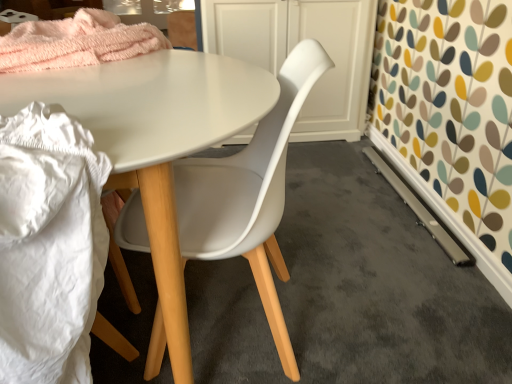
The width and height of the screenshot is (512, 384). I want to click on white matte cabinet at center, so click(x=295, y=45).

Is white fabric at lower left touching white matte cabinet at center?

There is a gap between white fabric at lower left and white matte cabinet at center.

From the image's perspective, would you say white fabric at lower left is shown under white matte cabinet at center?

Correct, white fabric at lower left appears lower than white matte cabinet at center in the image.

Which object is more forward, white fabric at lower left or white matte cabinet at center?

Positioned in front is white fabric at lower left.

From the image's perspective, between white matte cabinet at center and white fabric at lower left, who is located below?

white fabric at lower left appears lower in the image.

How different are the orientations of white matte cabinet at center and white fabric at lower left in degrees?

179 degrees separate the facing orientations of white matte cabinet at center and white fabric at lower left.

Does point (292, 28) come in front of point (7, 315)?

No, (292, 28) is behind (7, 315).

Consider the image. Is white matte cabinet at center in contact with white fabric at lower left?

No, white matte cabinet at center is not next to white fabric at lower left.

How far apart are white plastic chair at center and white fabric at lower left?

white plastic chair at center is 34.01 centimeters from white fabric at lower left.

Considering the points (193, 165) and (39, 287), which point is behind, point (193, 165) or point (39, 287)?

Positioned behind is point (193, 165).

Is white plastic chair at center wider than white fabric at lower left?

Incorrect, the width of white plastic chair at center does not surpass that of white fabric at lower left.

Which is more to the left, white plastic chair at center or white fabric at lower left?

From the viewer's perspective, white fabric at lower left appears more on the left side.

From the image's perspective, is white fabric at lower left over white plastic chair at center?

No, from the image's perspective, white fabric at lower left is not on top of white plastic chair at center.

Is white fabric at lower left positioned behind white plastic chair at center?

No.

Between white fabric at lower left and white plastic chair at center, which one has less height?

white fabric at lower left.

Which object is more forward, white matte cabinet at center or white plastic chair at center?

white plastic chair at center.

Is white matte cabinet at center turned away from white plastic chair at center?

No, white matte cabinet at center is not facing away from white plastic chair at center.

Can you see white matte cabinet at center touching white plastic chair at center?

No, white matte cabinet at center is not beside white plastic chair at center.

You are a GUI agent. You are given a task and a screenshot of the screen. Output one action in this format:
    pyautogui.click(x=<x>, y=<y>)
    Task: Click on the chair that appears in front of the white matte cabinet at center
    
    Given the screenshot: What is the action you would take?
    pyautogui.click(x=250, y=194)

From the image's perspective, is white plastic chair at center located above or below white matte cabinet at center?

Based on their image positions, white plastic chair at center is located beneath white matte cabinet at center.

Is white plastic chair at center taller or shorter than white matte cabinet at center?

Clearly, white plastic chair at center is taller compared to white matte cabinet at center.

From the picture: Between white plastic chair at center and white matte cabinet at center, which one appears on the left side from the viewer's perspective?

white plastic chair at center.

From a real-world perspective, is white plastic chair at center on white matte cabinet at center?

Indeed, from a real-world perspective, white plastic chair at center stands above white matte cabinet at center.

Find the location of a particular element. cabinetry located behind the white fabric at lower left is located at coordinates (295, 45).

Where is `cabinetry above the white fabric at lower left (from the image's perspective)`? This screenshot has width=512, height=384. cabinetry above the white fabric at lower left (from the image's perspective) is located at coordinates point(295,45).

From the image, which object appears to be nearer to white matte cabinet at center, white fabric at lower left or white plastic chair at center?

white plastic chair at center is positioned closer to the anchor white matte cabinet at center.

Which object lies further to the anchor point white plastic chair at center, white fabric at lower left or white matte cabinet at center?

→ white matte cabinet at center.

Based on their spatial positions, is white matte cabinet at center or white plastic chair at center further from white fabric at lower left?

Among the two, white matte cabinet at center is located further to white fabric at lower left.

Which object lies nearer to the anchor point white plastic chair at center, white matte cabinet at center or white fabric at lower left?

white fabric at lower left lies closer to white plastic chair at center than the other object.

Looking at the image, which one is located closer to white matte cabinet at center, white plastic chair at center or white fabric at lower left?

The object closer to white matte cabinet at center is white plastic chair at center.

In the scene shown: Considering their positions, is white plastic chair at center positioned further to white fabric at lower left than white matte cabinet at center?

white matte cabinet at center lies further to white fabric at lower left than the other object.

You are a GUI agent. You are given a task and a screenshot of the screen. Output one action in this format:
    pyautogui.click(x=<x>, y=<y>)
    Task: Click on the chair between white fabric at lower left and white matte cabinet at center along the z-axis
    The image size is (512, 384).
    Given the screenshot: What is the action you would take?
    pyautogui.click(x=250, y=194)